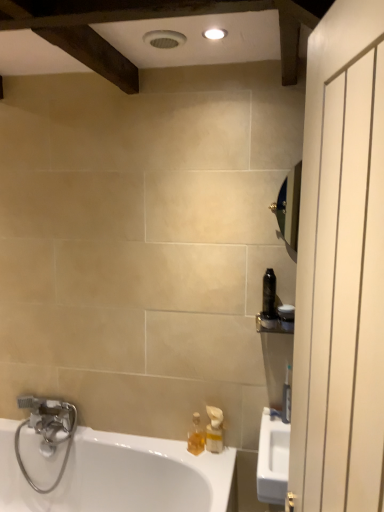
Question: Considering the relative positions of translucent plastic soap dispenser at lower center, arranged as the first soap dispenser when viewed from the left, and translucent plastic soap dispenser at lower center, placed as the first soap dispenser when sorted from right to left, in the image provided, is translucent plastic soap dispenser at lower center, arranged as the first soap dispenser when viewed from the left, to the right of translucent plastic soap dispenser at lower center, placed as the first soap dispenser when sorted from right to left, from the viewer's perspective?

Choices:
 (A) no
 (B) yes

Answer: (A)

Question: Is translucent plastic soap dispenser at lower center, arranged as the first soap dispenser when viewed from the left, taller than translucent plastic soap dispenser at lower center, marked as the 2th soap dispenser in a left-to-right arrangement?

Choices:
 (A) yes
 (B) no

Answer: (B)

Question: Is translucent plastic soap dispenser at lower center, which is the 2th soap dispenser from right to left, oriented away from translucent plastic soap dispenser at lower center, marked as the 2th soap dispenser in a left-to-right arrangement?

Choices:
 (A) yes
 (B) no

Answer: (B)

Question: Considering the relative positions of translucent plastic soap dispenser at lower center, arranged as the first soap dispenser when viewed from the left, and translucent plastic soap dispenser at lower center, placed as the first soap dispenser when sorted from right to left, in the image provided, is translucent plastic soap dispenser at lower center, arranged as the first soap dispenser when viewed from the left, behind translucent plastic soap dispenser at lower center, placed as the first soap dispenser when sorted from right to left,?

Choices:
 (A) yes
 (B) no

Answer: (A)

Question: Is translucent plastic soap dispenser at lower center, which is the 2th soap dispenser from right to left, placed right next to translucent plastic soap dispenser at lower center, marked as the 2th soap dispenser in a left-to-right arrangement?

Choices:
 (A) no
 (B) yes

Answer: (B)

Question: Is there a large distance between translucent plastic soap dispenser at lower center, which is the 2th soap dispenser from right to left, and translucent plastic soap dispenser at lower center, placed as the first soap dispenser when sorted from right to left?

Choices:
 (A) no
 (B) yes

Answer: (A)

Question: Is white glossy bathtub at lower left surrounded by black plastic bottle at right, acting as the 1th toiletry starting from the top?

Choices:
 (A) no
 (B) yes

Answer: (A)

Question: From the image's perspective, is black plastic bottle at right, acting as the 1th toiletry starting from the top, under white glossy bathtub at lower left?

Choices:
 (A) no
 (B) yes

Answer: (A)

Question: Is black plastic bottle at right, the third toiletry positioned from the bottom, shorter than white glossy bathtub at lower left?

Choices:
 (A) yes
 (B) no

Answer: (A)

Question: Is black plastic bottle at right, acting as the 1th toiletry starting from the top, thinner than white glossy bathtub at lower left?

Choices:
 (A) yes
 (B) no

Answer: (A)

Question: From a real-world perspective, is black plastic bottle at right, the third toiletry positioned from the bottom, physically below white glossy bathtub at lower left?

Choices:
 (A) no
 (B) yes

Answer: (A)

Question: Does black plastic bottle at right, acting as the 1th toiletry starting from the top, have a smaller size compared to white glossy bathtub at lower left?

Choices:
 (A) no
 (B) yes

Answer: (B)

Question: Is white glossy bathtub at lower left thinner than white plastic toothbrush at right, the first toiletry when ordered from bottom to top?

Choices:
 (A) no
 (B) yes

Answer: (A)